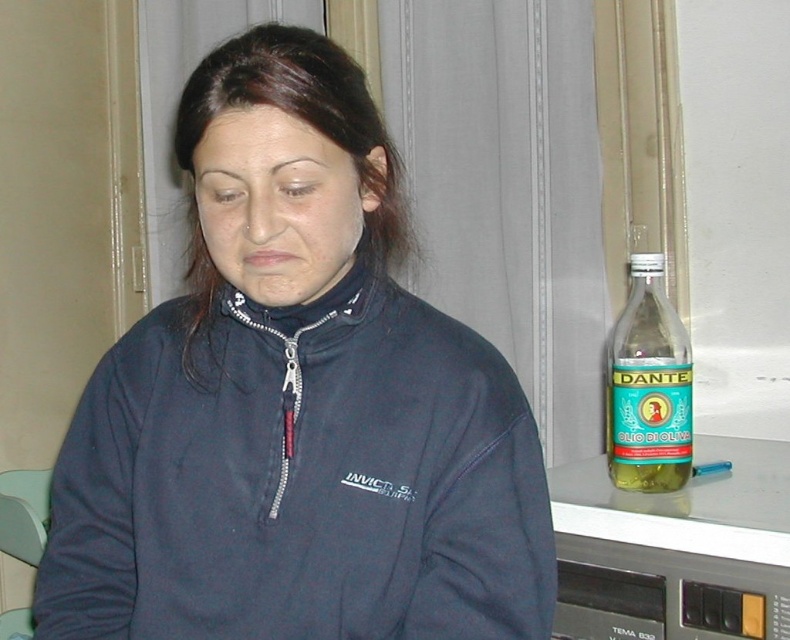
Between dark blue fleece at center and green glass bottle at right, which one appears on the left side from the viewer's perspective?

Positioned to the left is dark blue fleece at center.

Between dark blue fleece at center and green glass bottle at right, which one is positioned lower?

green glass bottle at right is below.

Locate an element on the screen. dark blue fleece at center is located at coordinates (295, 404).